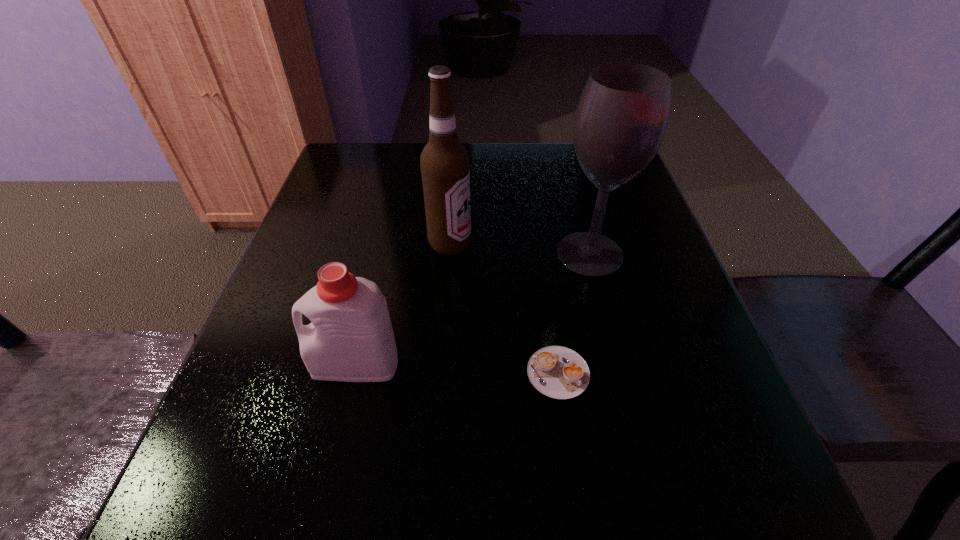
At what (x,y) coordinates should I click in order to perform the action: click on blank region between the second shortest object and the shortest object. Please return your answer as a coordinate pair (x, y). This screenshot has height=540, width=960. Looking at the image, I should click on (457, 368).

Identify the location of vacant area that lies between the shortest object and the right alcohol. Image resolution: width=960 pixels, height=540 pixels. (574, 313).

Find the location of `vacant region between the cappuccino and the third tallest object`. vacant region between the cappuccino and the third tallest object is located at coordinates (x=457, y=368).

You are a GUI agent. You are given a task and a screenshot of the screen. Output one action in this format:
    pyautogui.click(x=<x>, y=<y>)
    Task: Click on the vacant point located between the third tallest object and the second object from left to right
    
    Given the screenshot: What is the action you would take?
    pyautogui.click(x=402, y=304)

You are a GUI agent. You are given a task and a screenshot of the screen. Output one action in this format:
    pyautogui.click(x=<x>, y=<y>)
    Task: Click on the free space between the left alcohol and the right alcohol
    The image size is (960, 540).
    Given the screenshot: What is the action you would take?
    pyautogui.click(x=520, y=249)

I want to click on free space that is in between the leftmost object and the right alcohol, so click(472, 309).

Where is `free spot between the shortest object and the leftmost object`? The image size is (960, 540). free spot between the shortest object and the leftmost object is located at coordinates 457,368.

You are a GUI agent. You are given a task and a screenshot of the screen. Output one action in this format:
    pyautogui.click(x=<x>, y=<y>)
    Task: Click on the blank region between the third tallest object and the left alcohol
    The width and height of the screenshot is (960, 540).
    Given the screenshot: What is the action you would take?
    pyautogui.click(x=402, y=304)

Choose which object is the nearest neighbor to the left alcohol. Please provide its 2D coordinates. Your answer should be formatted as a tuple, i.e. [(x, y)], where the tuple contains the x and y coordinates of a point satisfying the conditions above.

[(621, 118)]

Locate an element on the screen. the second closest object to the left alcohol is located at coordinates (351, 339).